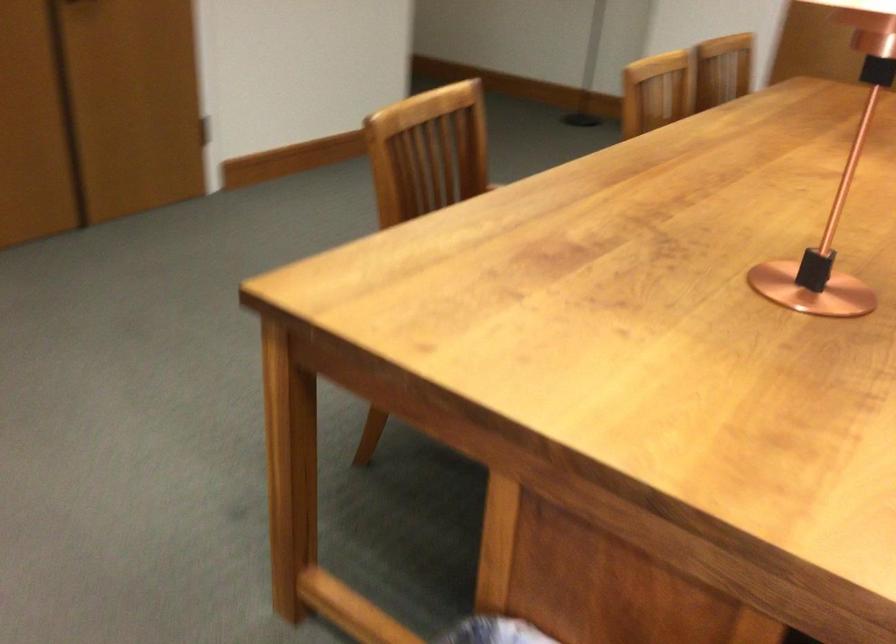
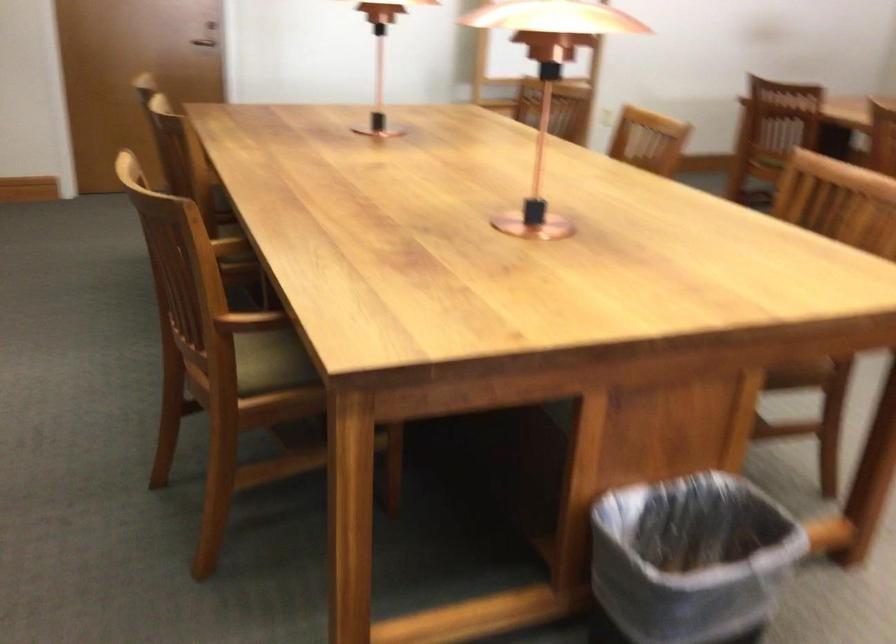
In the second image, find the point that corresponds to (408,254) in the first image.

(250, 321)